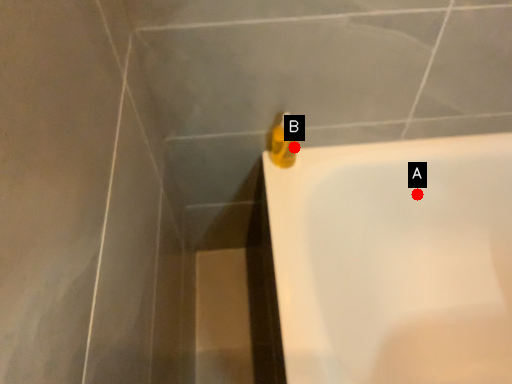
Question: Two points are circled on the image, labeled by A and B beside each circle. Which point appears farthest from the camera in this image?

Choices:
 (A) A is further
 (B) B is further

Answer: (A)